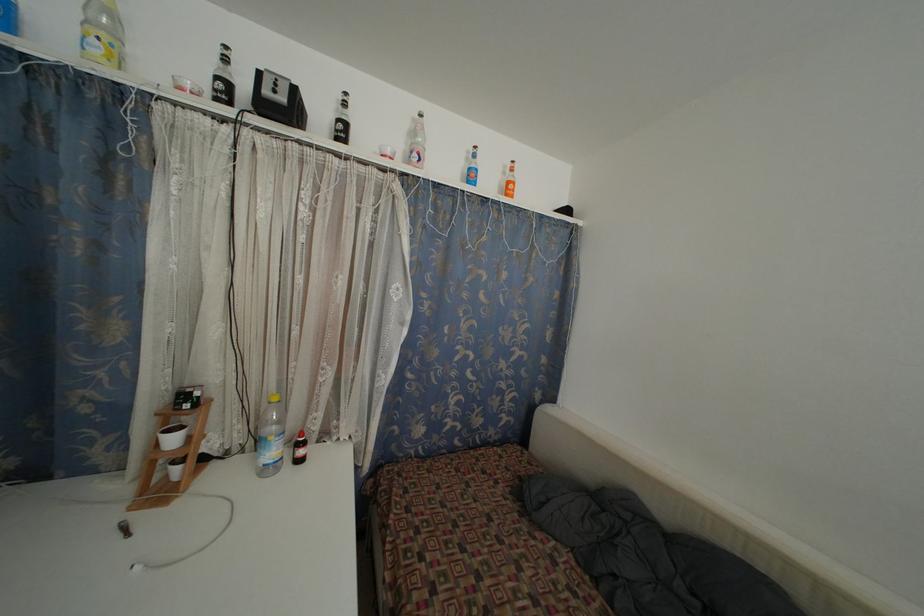
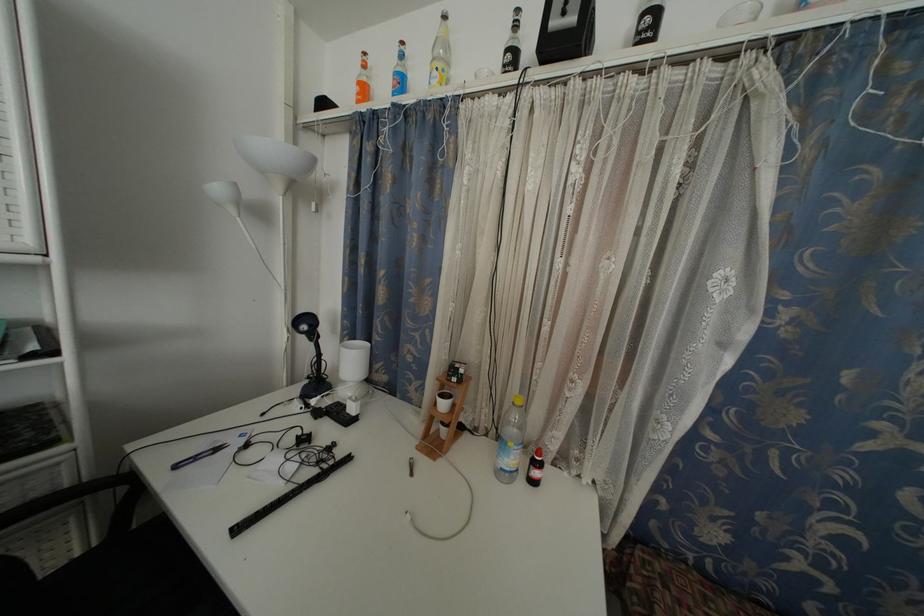
Question: The camera is either moving clockwise (left) or counter-clockwise (right) around the object. The first image is from the beginning of the video and the second image is from the end. Is the camera moving left or right when shooting the video?

Choices:
 (A) Left
 (B) Right

Answer: (B)